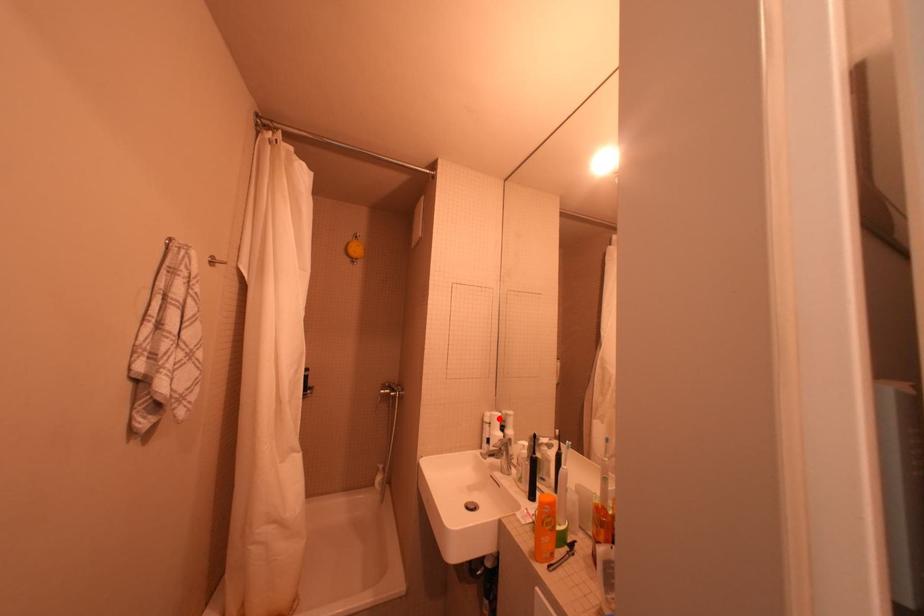
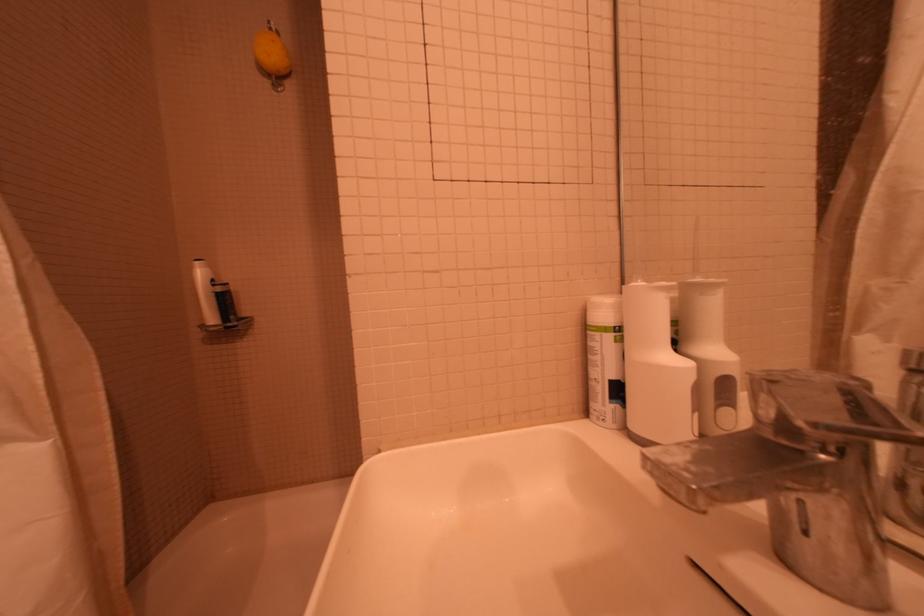
Question: I am providing you with two images of the same scene from different viewpoints. A red point is shown in image1. For the corresponding object point in image2, is it positioned nearer or farther from the camera?

Choices:
 (A) Nearer
 (B) Farther

Answer: (A)